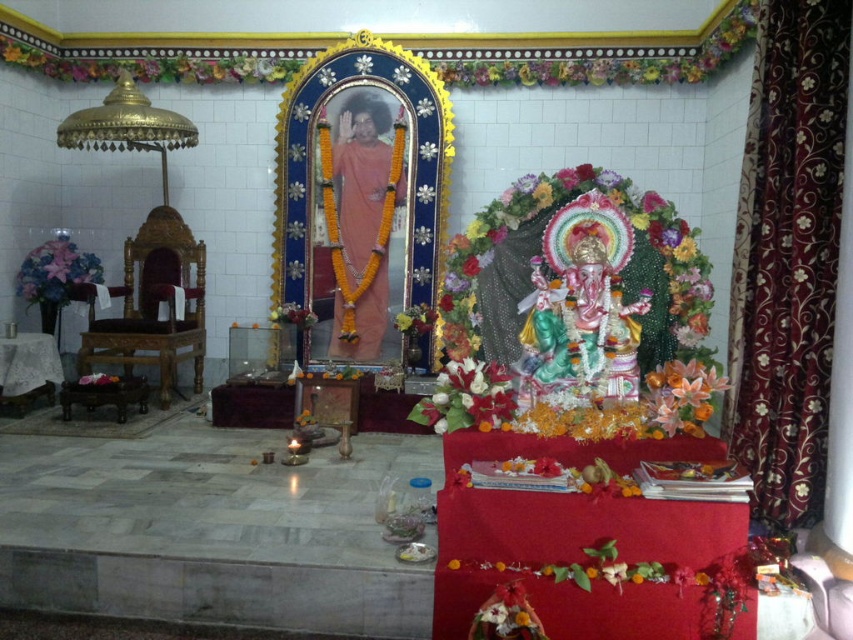
You are standing in the temple and want to place a new offering directly in front of the floral garland at center. Where should you place it based on the coordinates provided?

The floral garland at center is located at coordinates point [540,253], so you should place the new offering directly in front of this point to ensure it is positioned correctly.

You are an interior designer planning to place a new decorative item in the temple. You have a small golden bell that is the same size as the orange silk flower at lower right. Where should you place the bell so it doesn not overwhelm the existing matte pink statue at center?

Since the matte pink statue at center is bigger than the orange silk flower at lower right, placing the small golden bell near the orange silk flower at lower right would maintain visual balance without overshadowing the larger statue.

You are an interior designer planning to rearrange the altar. You need to place a new golden candle holder exactly between the matte pink statue at center and the orange silk flower at lower right. Based on their current positions, where should you position the candle holder?

The matte pink statue at center is to the left of the orange silk flower at lower right, so the golden candle holder should be placed in the middle between them, equidistant from both objects.